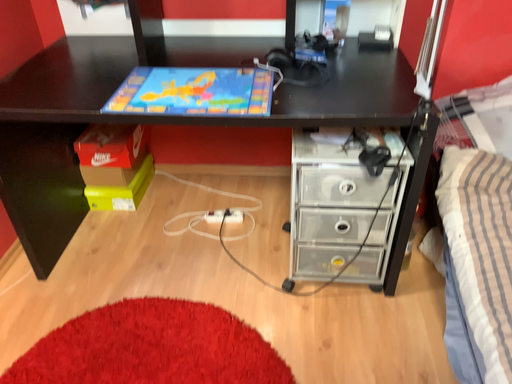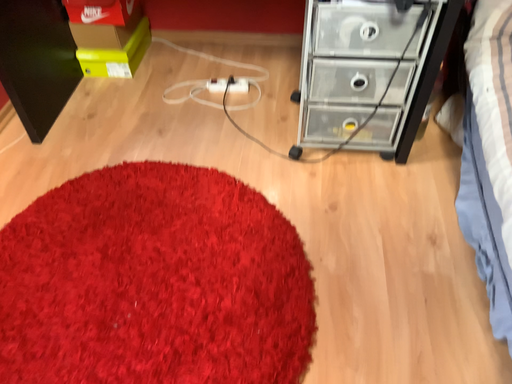
Question: Which way did the camera rotate in the video?

Choices:
 (A) rotated upward
 (B) rotated downward

Answer: (B)